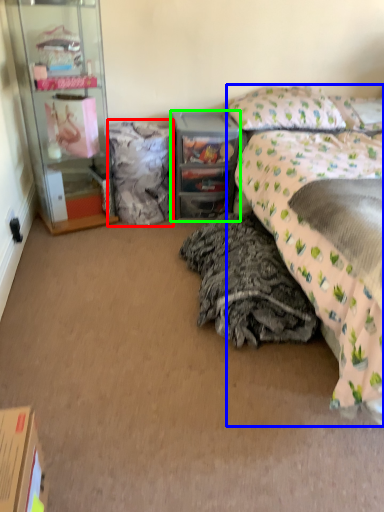
Question: Which object is the farthest from material (highlighted by a red box)? Choose among these: bed (highlighted by a blue box) or desk (highlighted by a green box).

Choices:
 (A) bed
 (B) desk

Answer: (A)